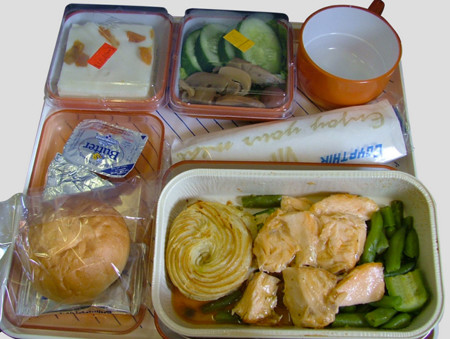
At what (x,y) coordinates should I click in order to perform the action: click on cup handle. Please return your answer as a coordinate pair (x, y). Looking at the image, I should click on (377, 6).